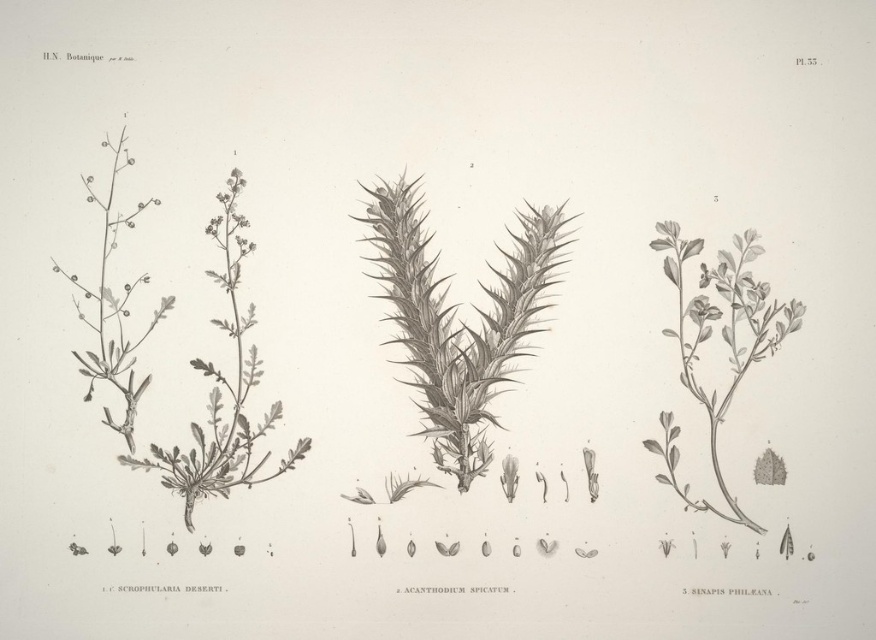
Is gray textured plant at center thinner than green leafy plant at center right?

No, gray textured plant at center is not thinner than green leafy plant at center right.

Image resolution: width=876 pixels, height=640 pixels. I want to click on gray textured plant at center, so click(x=458, y=320).

Locate an element on the screen. The width and height of the screenshot is (876, 640). gray textured plant at center is located at coordinates (458, 320).